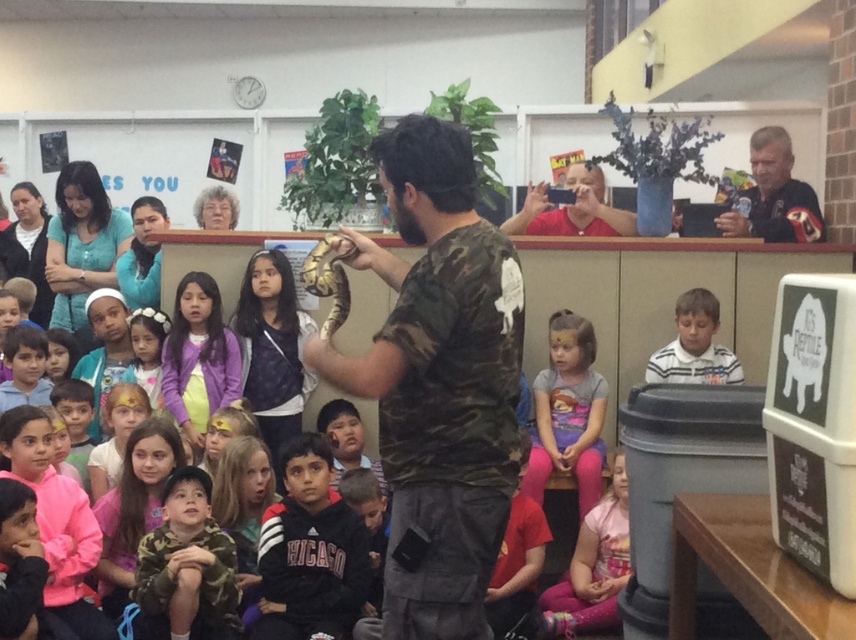
Can you confirm if camouflage fabric shirt at center is positioned to the right of white striped shirt at center?

Incorrect, camouflage fabric shirt at center is not on the right side of white striped shirt at center.

Which of these two, camouflage fabric shirt at center or white striped shirt at center, stands shorter?

white striped shirt at center is shorter.

You are a GUI agent. You are given a task and a screenshot of the screen. Output one action in this format:
    pyautogui.click(x=<x>, y=<y>)
    Task: Click on the camouflage fabric shirt at center
    
    Given the screenshot: What is the action you would take?
    pyautogui.click(x=438, y=381)

You are a GUI agent. You are given a task and a screenshot of the screen. Output one action in this format:
    pyautogui.click(x=<x>, y=<y>)
    Task: Click on the camouflage fabric shirt at center
    The image size is (856, 640).
    Given the screenshot: What is the action you would take?
    [x=438, y=381]

Can you confirm if camo fabric shirt at lower left is positioned to the right of white striped shirt at center?

In fact, camo fabric shirt at lower left is to the left of white striped shirt at center.

Can you confirm if camo fabric shirt at lower left is positioned to the left of white striped shirt at center?

Correct, you'll find camo fabric shirt at lower left to the left of white striped shirt at center.

Where is `camo fabric shirt at lower left`? The height and width of the screenshot is (640, 856). camo fabric shirt at lower left is located at coordinates (187, 564).

Between matte gray shirt at center and dark gray leather jacket at upper right, which one is positioned higher?

dark gray leather jacket at upper right is higher up.

I want to click on matte gray shirt at center, so click(x=568, y=412).

You are a GUI agent. You are given a task and a screenshot of the screen. Output one action in this format:
    pyautogui.click(x=<x>, y=<y>)
    Task: Click on the matte gray shirt at center
    This screenshot has height=640, width=856.
    Given the screenshot: What is the action you would take?
    click(568, 412)